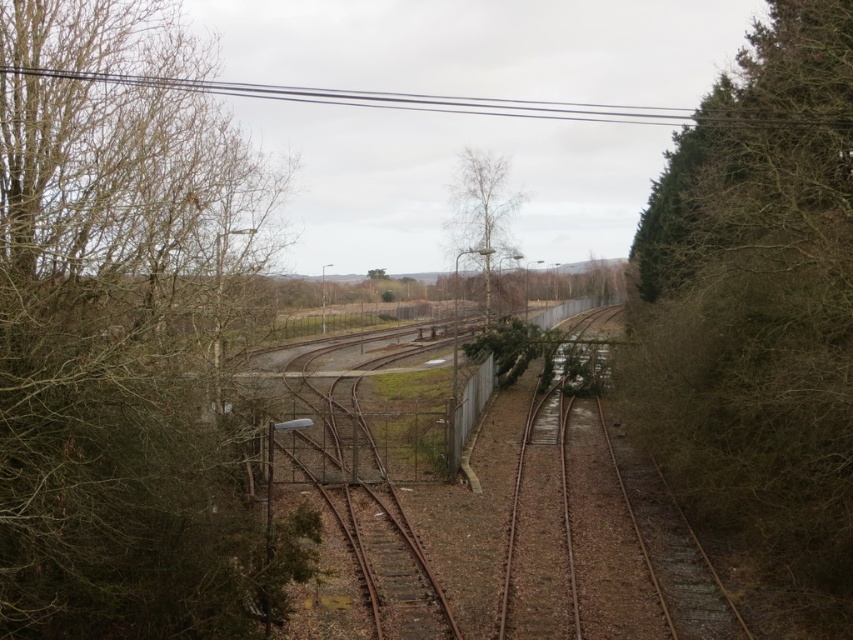
Question: Does green leafy tree at right have a greater width compared to bare wood tree at center?

Choices:
 (A) no
 (B) yes

Answer: (A)

Question: Can you confirm if brown leafless tree at left is bigger than bare wood tree at center?

Choices:
 (A) no
 (B) yes

Answer: (B)

Question: Can you confirm if brown leafless tree at left is positioned below green leafy tree at right?

Choices:
 (A) no
 (B) yes

Answer: (B)

Question: Which object is closer to the camera taking this photo?

Choices:
 (A) bare wood tree at center
 (B) green leafy tree at right

Answer: (B)

Question: Estimate the real-world distances between objects in this image. Which object is farther from the brown leafless tree at left?

Choices:
 (A) green leafy tree at right
 (B) bare wood tree at center

Answer: (B)

Question: Which point is closer to the camera?

Choices:
 (A) green leafy tree at right
 (B) brown leafless tree at left

Answer: (B)